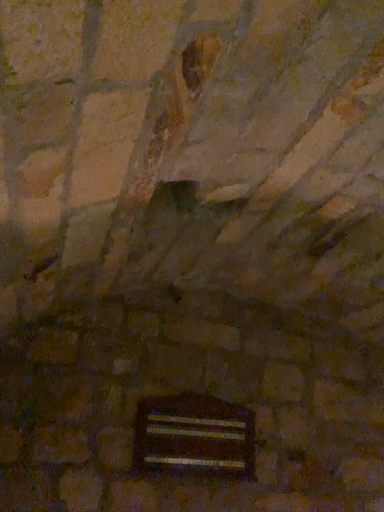
The image size is (384, 512). What do you see at coordinates (194, 436) in the screenshot? I see `wooden piano at center` at bounding box center [194, 436].

The image size is (384, 512). I want to click on wooden piano at center, so click(194, 436).

The width and height of the screenshot is (384, 512). What are the coordinates of `wooden piano at center` in the screenshot? It's located at (194, 436).